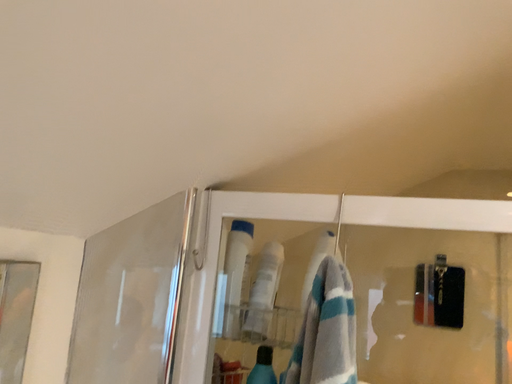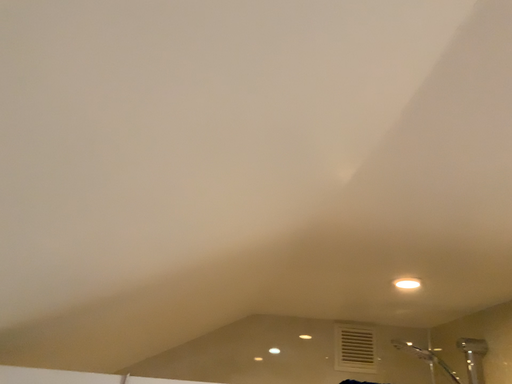
Question: Which way did the camera rotate in the video?

Choices:
 (A) rotated left
 (B) rotated right

Answer: (B)